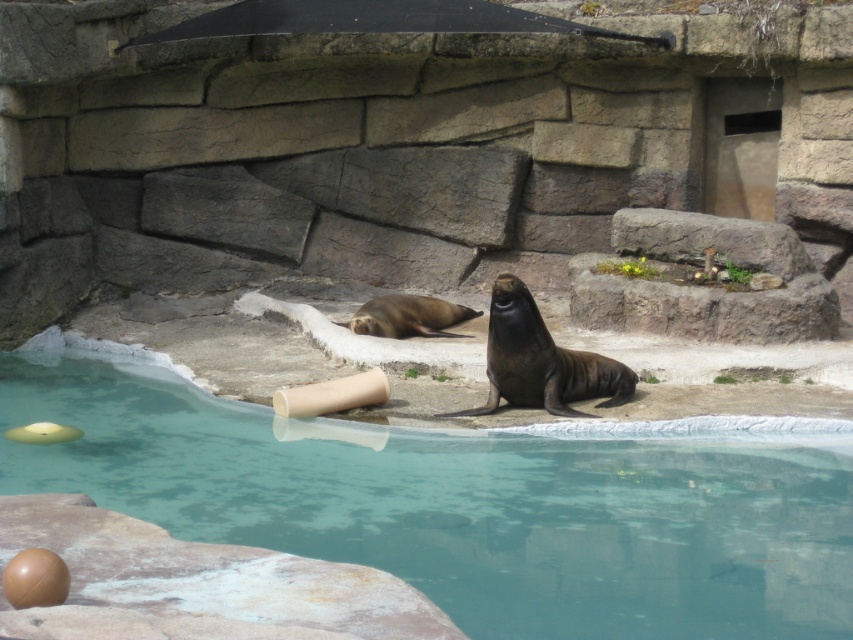
Describe the element at coordinates (462, 506) in the screenshot. I see `transparent glass swimming pool at lower center` at that location.

Describe the element at coordinates (462, 506) in the screenshot. The image size is (853, 640). I see `transparent glass swimming pool at lower center` at that location.

Where is `transparent glass swimming pool at lower center`? This screenshot has width=853, height=640. transparent glass swimming pool at lower center is located at coordinates (462, 506).